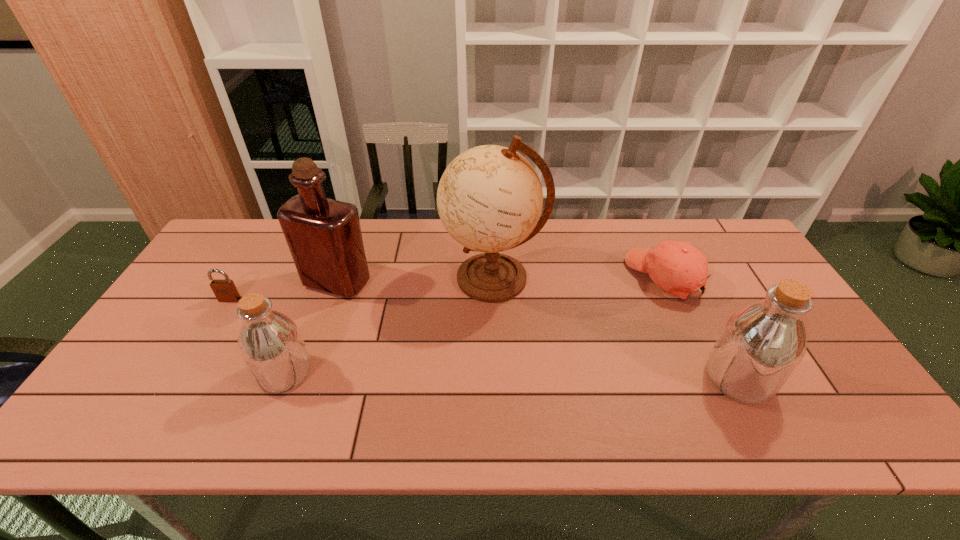
This screenshot has height=540, width=960. In order to click on free space at the far edge of the desktop in this screenshot , I will do `click(596, 247)`.

In the image, there is a desktop. At what (x,y) coordinates should I click in order to perform the action: click on vacant area at the near edge. Please return your answer as a coordinate pair (x, y). This screenshot has height=540, width=960. Looking at the image, I should click on (589, 398).

Locate an element on the screen. vacant region at the left edge of the desktop is located at coordinates (202, 273).

I want to click on vacant space at the right edge of the desktop, so click(753, 287).

The image size is (960, 540). Find the location of `vacant space at the far right corner of the desktop`. vacant space at the far right corner of the desktop is located at coordinates (732, 234).

The image size is (960, 540). I want to click on free area in between the liquor and the third shortest object, so tap(311, 327).

Where is `free point between the fifth tallest object and the taller bottle`? Image resolution: width=960 pixels, height=540 pixels. free point between the fifth tallest object and the taller bottle is located at coordinates (702, 328).

Locate an element on the screen. This screenshot has width=960, height=540. free space that is in between the liquor and the shortest object is located at coordinates (283, 291).

I want to click on vacant area between the right bottle and the liquor, so click(x=538, y=330).

Where is `vacant point located between the third object from right to left and the fourth tallest object`? vacant point located between the third object from right to left and the fourth tallest object is located at coordinates (390, 326).